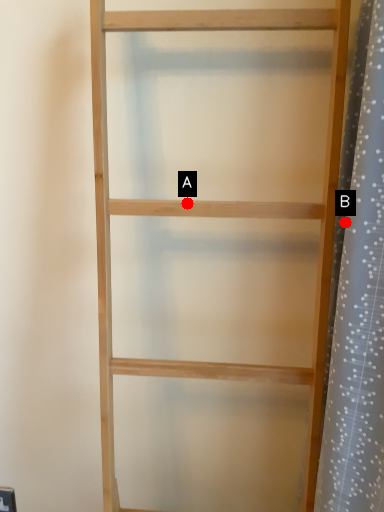
Question: Two points are circled on the image, labeled by A and B beside each circle. Which point appears farthest from the camera in this image?

Choices:
 (A) A is further
 (B) B is further

Answer: (A)